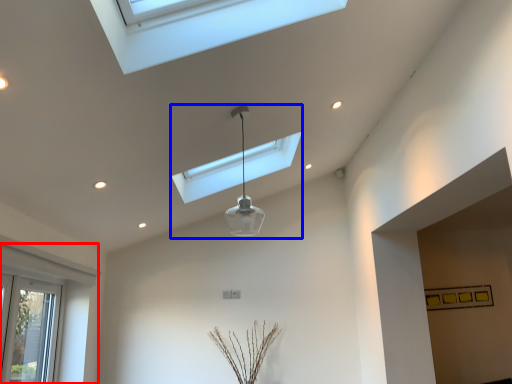
Question: Which object appears closest to the camera in this image, window (highlighted by a red box) or lamp (highlighted by a blue box)?

Choices:
 (A) window
 (B) lamp

Answer: (A)